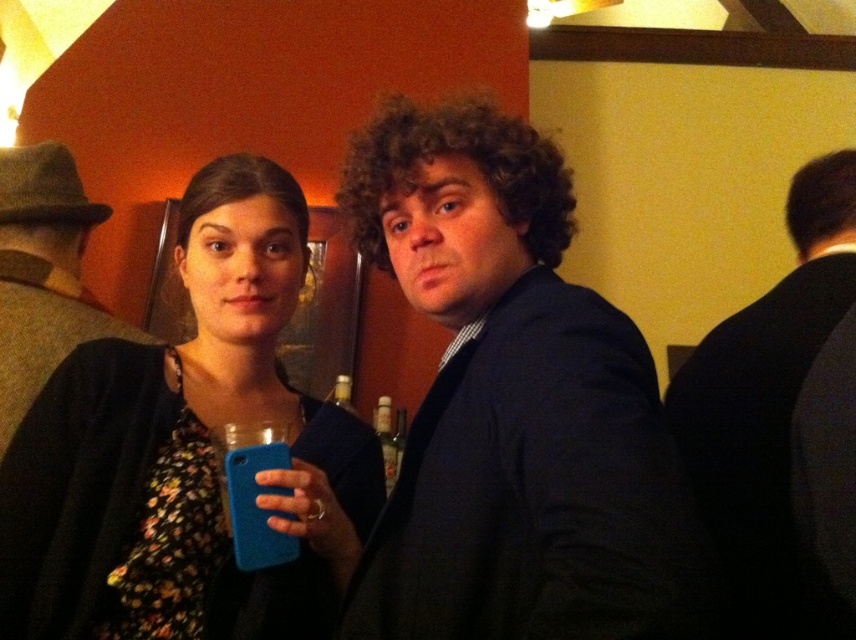
Based on the photo, who is more distant from viewer, (189, 627) or (741, 310)?

The point (741, 310) is behind.

From the picture: Does matte blue phone at center have a lesser width compared to dark blue suit at right?

No.

The width and height of the screenshot is (856, 640). Identify the location of matte blue phone at center. (186, 451).

Can you confirm if dark blue suit at center is thinner than matte blue phone at center?

Indeed, dark blue suit at center has a lesser width compared to matte blue phone at center.

Image resolution: width=856 pixels, height=640 pixels. In order to click on dark blue suit at center in this screenshot , I will do `click(510, 404)`.

Does dark blue suit at center appear over dark blue suit at right?

Actually, dark blue suit at center is below dark blue suit at right.

Is point (437, 310) positioned after point (706, 369)?

No.

Where is `dark blue suit at center`? The width and height of the screenshot is (856, 640). dark blue suit at center is located at coordinates (510, 404).